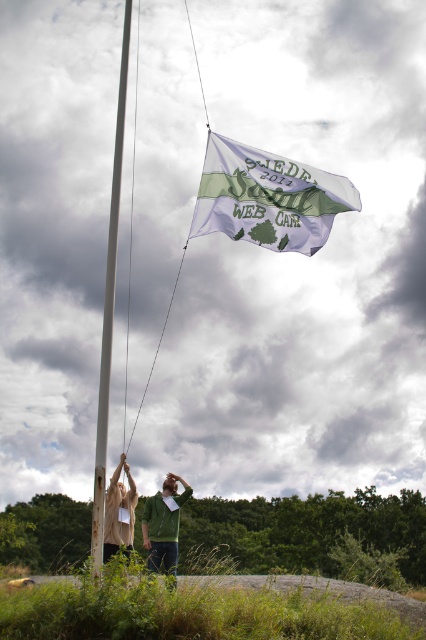
Question: Which of the following is the farthest from the observer?

Choices:
 (A) (112, 496)
 (B) (109, 340)
 (C) (161, 525)
 (D) (233, 198)

Answer: (C)

Question: Is white fabric flag at upper center thinner than beige cotton hoodie at lower left?

Choices:
 (A) no
 (B) yes

Answer: (A)

Question: Which point appears closest to the camera in this image?

Choices:
 (A) (157, 509)
 (B) (97, 557)
 (C) (115, 522)

Answer: (B)

Question: Which point is closer to the camera?

Choices:
 (A) green cotton hoodie at center
 (B) beige cotton hoodie at lower left
 (C) smooth white pole at center
 (D) white fabric flag at upper center

Answer: (C)

Question: Can you confirm if smooth white pole at center is bigger than green cotton hoodie at center?

Choices:
 (A) no
 (B) yes

Answer: (B)

Question: Is the position of smooth white pole at center less distant than that of green cotton hoodie at center?

Choices:
 (A) yes
 (B) no

Answer: (A)